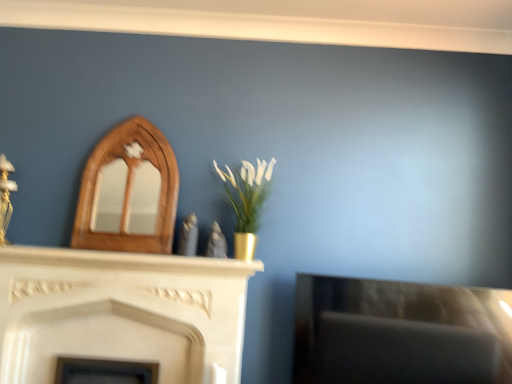
Question: Considering the relative sizes of gold metallic vase at center and white marble mantle at center in the image provided, is gold metallic vase at center smaller than white marble mantle at center?

Choices:
 (A) no
 (B) yes

Answer: (A)

Question: From a real-world perspective, is gold metallic vase at center on white marble mantle at center?

Choices:
 (A) no
 (B) yes

Answer: (B)

Question: Does gold metallic vase at center have a lesser height compared to white marble mantle at center?

Choices:
 (A) no
 (B) yes

Answer: (A)

Question: Does gold metallic vase at center touch white marble mantle at center?

Choices:
 (A) no
 (B) yes

Answer: (A)

Question: Is gold metallic vase at center not within white marble mantle at center?

Choices:
 (A) yes
 (B) no

Answer: (A)

Question: Is point (228, 195) positioned closer to the camera than point (161, 144)?

Choices:
 (A) farther
 (B) closer

Answer: (A)

Question: Do you think gold metallic vase at center is within wooden mirror at upper left, placed as the 2th fireplace when sorted from bottom to top, or outside of it?

Choices:
 (A) outside
 (B) inside

Answer: (A)

Question: In terms of size, does gold metallic vase at center appear bigger or smaller than wooden mirror at upper left, which is the first fireplace in top-to-bottom order?

Choices:
 (A) small
 (B) big

Answer: (B)

Question: Would you say gold metallic vase at center is to the left or to the right of wooden mirror at upper left, placed as the 2th fireplace when sorted from bottom to top, in the picture?

Choices:
 (A) left
 (B) right

Answer: (B)

Question: From the image's perspective, relative to white marble fireplace at center, which ranks as the first fireplace in bottom-to-top order, is gold metallic vase at center above or below?

Choices:
 (A) below
 (B) above

Answer: (B)

Question: Is gold metallic vase at center inside or outside of white marble fireplace at center, which ranks as the first fireplace in bottom-to-top order?

Choices:
 (A) outside
 (B) inside

Answer: (A)

Question: Considering the relative positions of gold metallic vase at center and white marble fireplace at center, which ranks as the first fireplace in bottom-to-top order, in the image provided, is gold metallic vase at center to the left or to the right of white marble fireplace at center, which ranks as the first fireplace in bottom-to-top order,?

Choices:
 (A) right
 (B) left

Answer: (A)

Question: Is point (266, 175) closer or farther from the camera than point (200, 352)?

Choices:
 (A) closer
 (B) farther

Answer: (B)

Question: From a real-world perspective, is wooden mirror at upper left, placed as the 2th fireplace when sorted from bottom to top, positioned above or below white marble fireplace at center, which ranks as the first fireplace in bottom-to-top order?

Choices:
 (A) below
 (B) above

Answer: (B)

Question: Considering the positions of wooden mirror at upper left, placed as the 2th fireplace when sorted from bottom to top, and white marble fireplace at center, which ranks as the first fireplace in bottom-to-top order, in the image, is wooden mirror at upper left, placed as the 2th fireplace when sorted from bottom to top, taller or shorter than white marble fireplace at center, which ranks as the first fireplace in bottom-to-top order,?

Choices:
 (A) short
 (B) tall

Answer: (B)